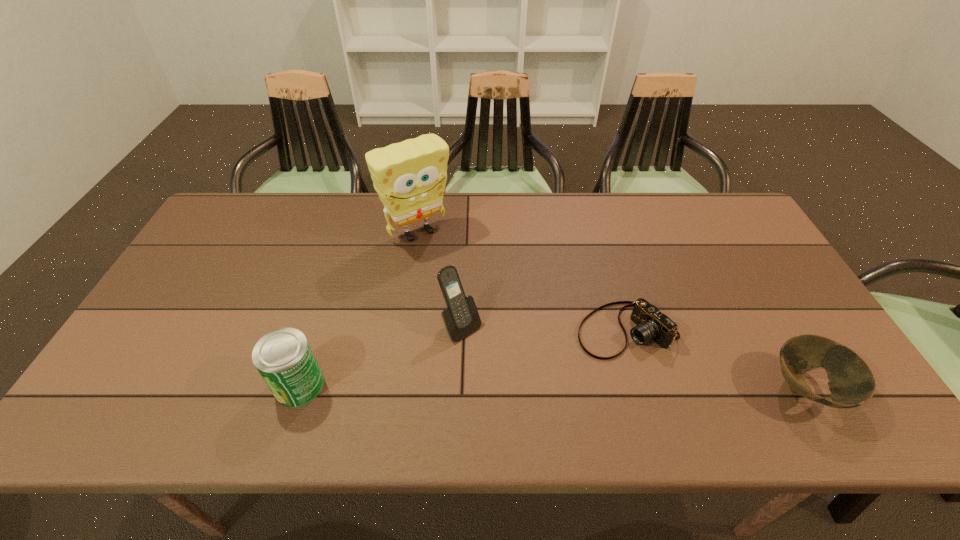
Locate an element on the screen. This screenshot has width=960, height=540. free spot on the desktop that is between the can and the bowl and is positioned on the face of the farthest object is located at coordinates (545, 387).

I want to click on vacant space on the desktop that is between the leftmost object and the bowl and is positioned on the front-facing side of the second tallest object, so click(517, 387).

At what (x,y) coordinates should I click in order to perform the action: click on vacant space on the desktop that is between the leftmost object and the rightmost object and is positioned on the front-facing side of the camera. Please return your answer as a coordinate pair (x, y). This screenshot has width=960, height=540. Looking at the image, I should click on (528, 387).